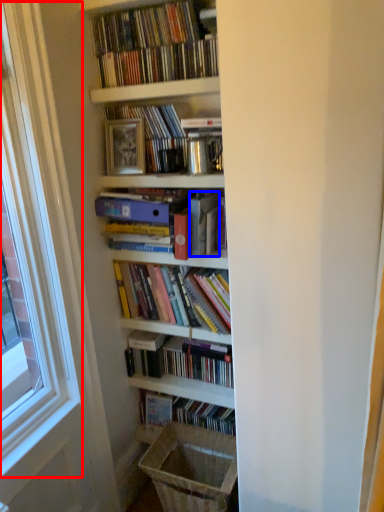
Question: Which point is closer to the camera, window frame (highlighted by a red box) or paperback book (highlighted by a blue box)?

Choices:
 (A) window frame
 (B) paperback book

Answer: (A)